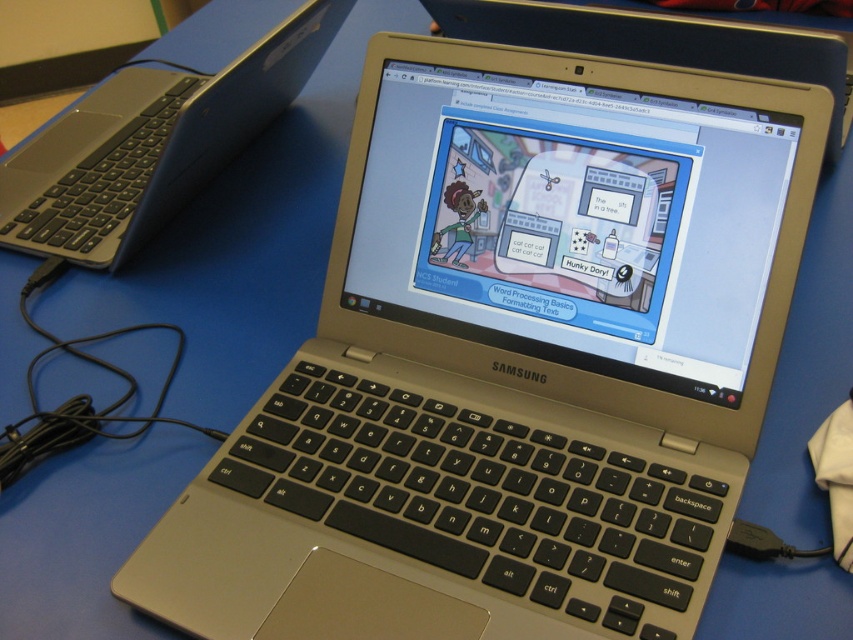
How far apart are silver metallic laptop at center and metallic silver laptop at center?

silver metallic laptop at center is 33.37 centimeters from metallic silver laptop at center.

Which of these two, silver metallic laptop at center or metallic silver laptop at center, stands taller?

Standing taller between the two is silver metallic laptop at center.

This screenshot has width=853, height=640. Describe the element at coordinates (151, 145) in the screenshot. I see `silver metallic laptop at center` at that location.

Identify the location of silver metallic laptop at center. The image size is (853, 640). (151, 145).